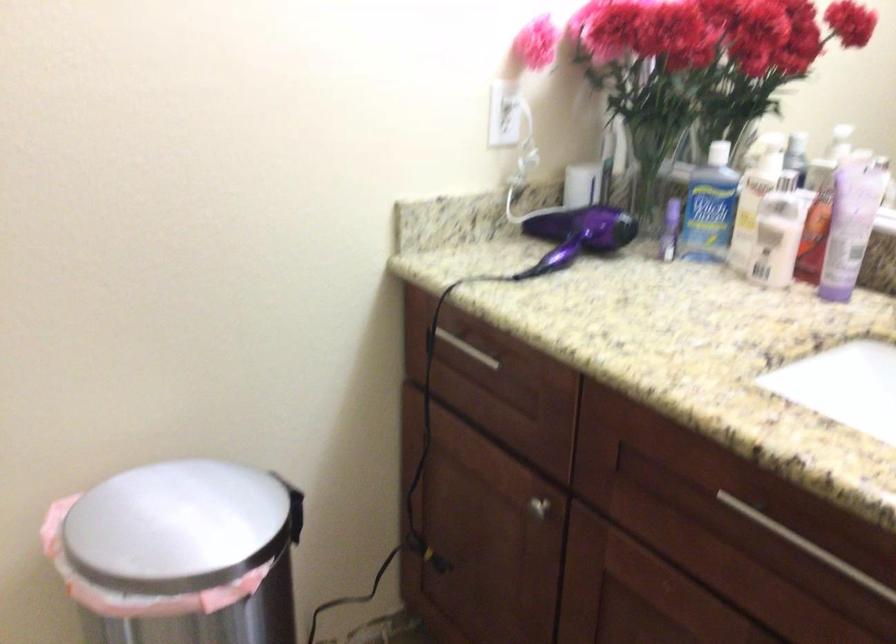
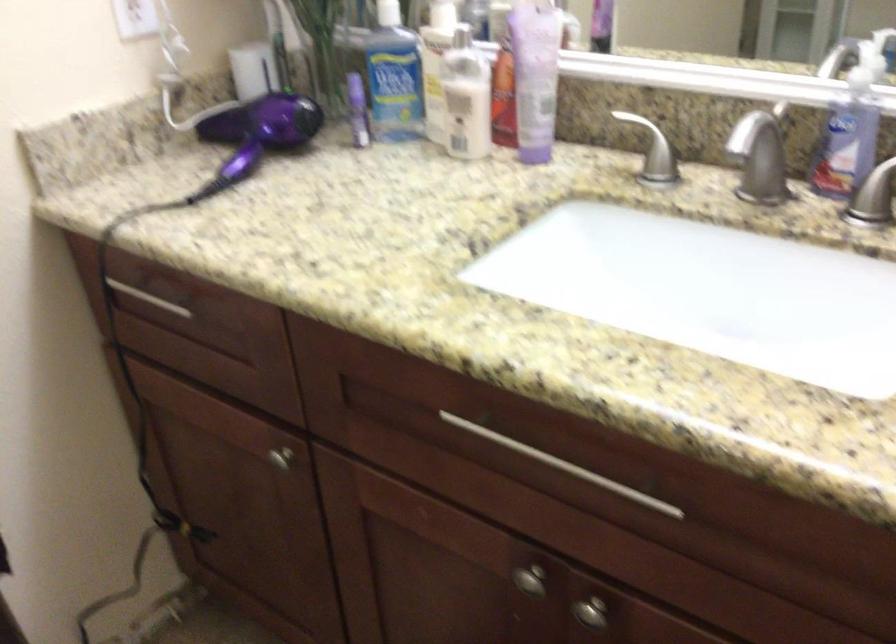
In the second image, find the point that corresponds to (537,509) in the first image.

(280, 459)